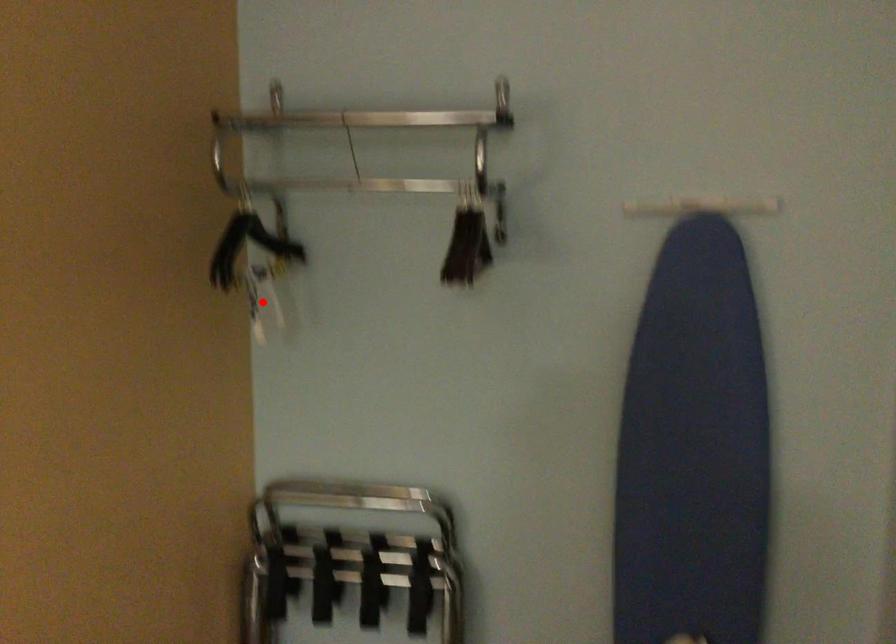
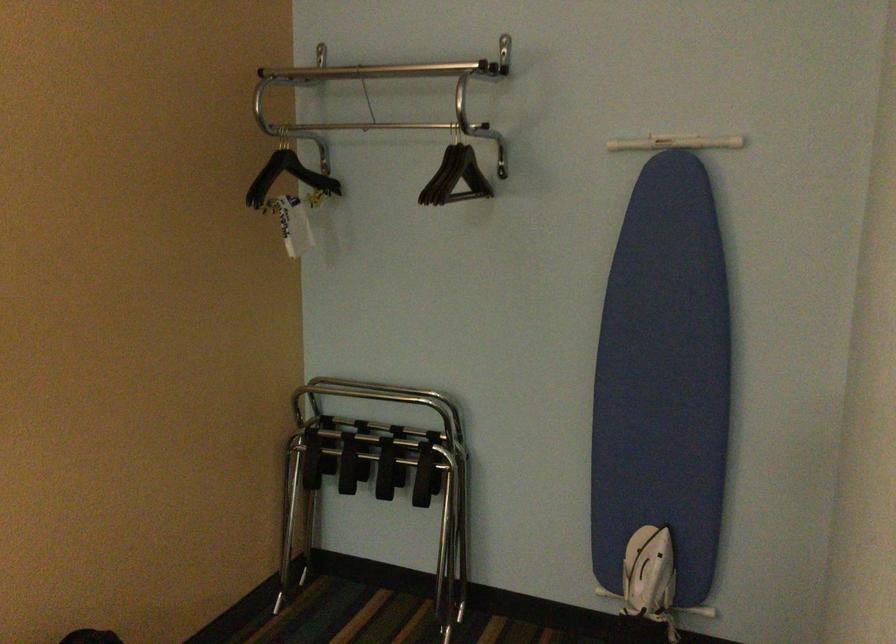
Question: I am providing you with two images of the same scene from different viewpoints. A red point is shown in image1. For the corresponding object point in image2, is it positioned nearer or farther from the camera?

Choices:
 (A) Nearer
 (B) Farther

Answer: (B)